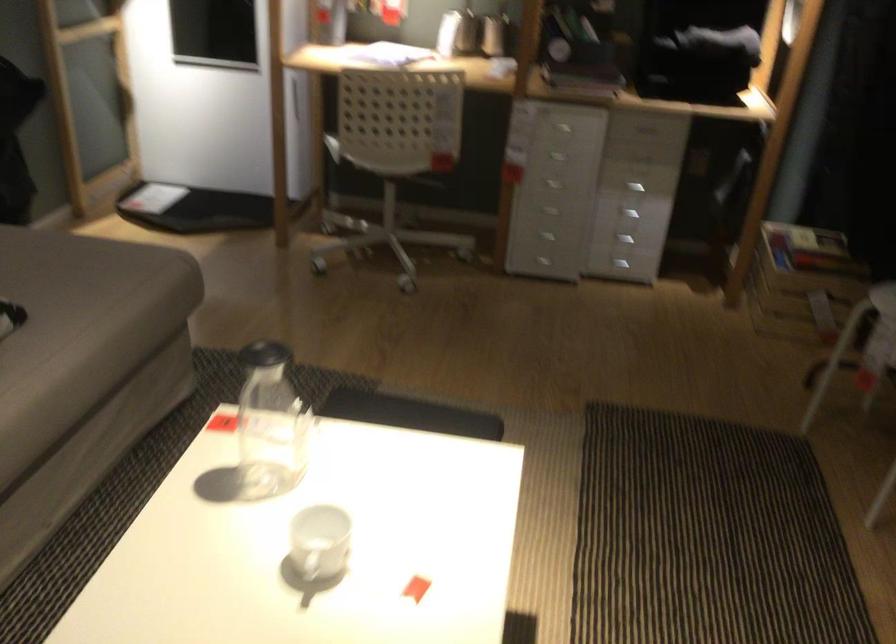
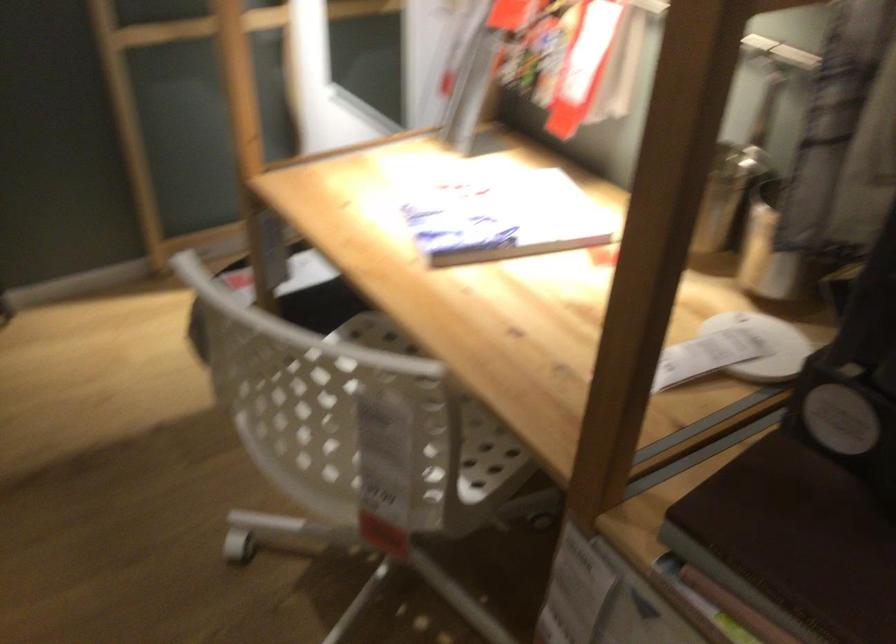
Locate, in the second image, the point that corresponds to point (582, 67) in the first image.

(793, 542)